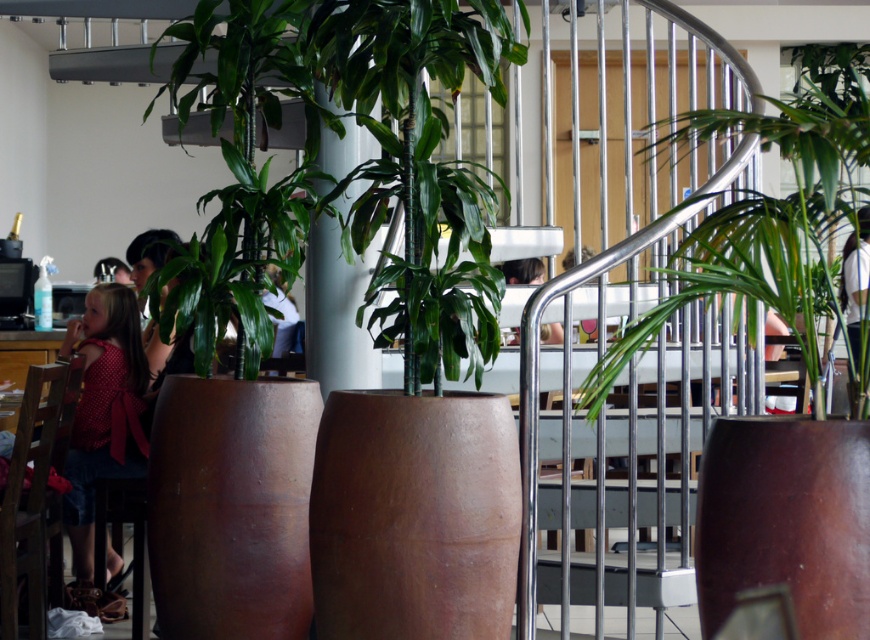
Does point (668, 276) lie behind point (844, 252)?

No.

Consider the image. Who is more forward, (704, 241) or (848, 248)?

Point (704, 241)

Locate an element on the screen. This screenshot has width=870, height=640. green leafy plant at center is located at coordinates (773, 216).

Does dotted fabric dress at lower left appear on the right side of white fabric shirt at center?

No, dotted fabric dress at lower left is not to the right of white fabric shirt at center.

Can you confirm if dotted fabric dress at lower left is positioned below white fabric shirt at center?

Correct, dotted fabric dress at lower left is located below white fabric shirt at center.

Find the location of a particular element. This screenshot has width=870, height=640. dotted fabric dress at lower left is located at coordinates (104, 410).

What are the coordinates of `dotted fabric dress at lower left` in the screenshot? It's located at (104, 410).

Does green glossy plant at center have a lesser height compared to smooth brown hair at center?

No, green glossy plant at center is not shorter than smooth brown hair at center.

Image resolution: width=870 pixels, height=640 pixels. Describe the element at coordinates (228, 72) in the screenshot. I see `green glossy plant at center` at that location.

You are a GUI agent. You are given a task and a screenshot of the screen. Output one action in this format:
    pyautogui.click(x=<x>, y=<y>)
    Task: Click on the green glossy plant at center
    The height and width of the screenshot is (640, 870).
    Given the screenshot: What is the action you would take?
    pyautogui.click(x=228, y=72)